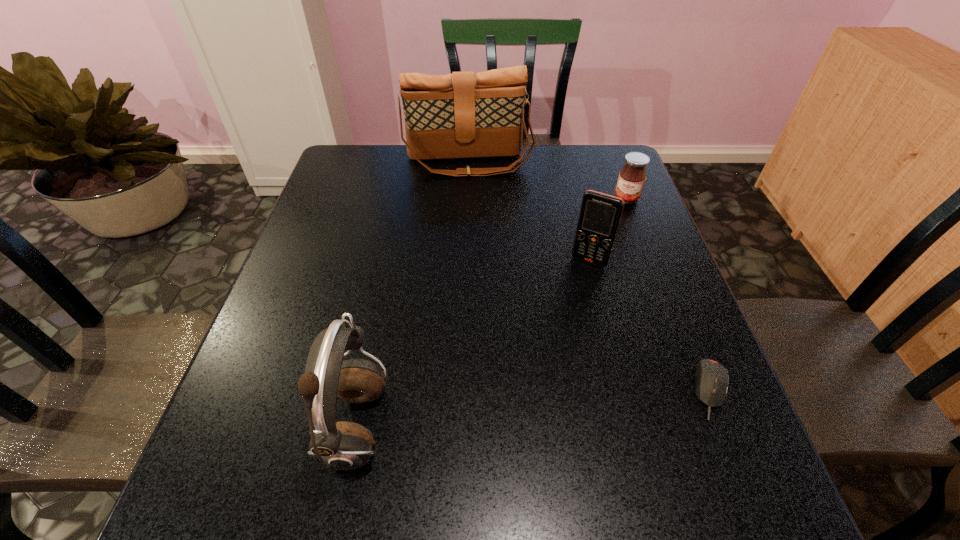
In order to click on object that ranks as the closest to the jam in this screenshot , I will do `click(600, 214)`.

Locate an element on the screen. free space that satisfies the following two spatial constraints: 1. on the front side of the farthest object; 2. on the right side of the jam is located at coordinates (468, 199).